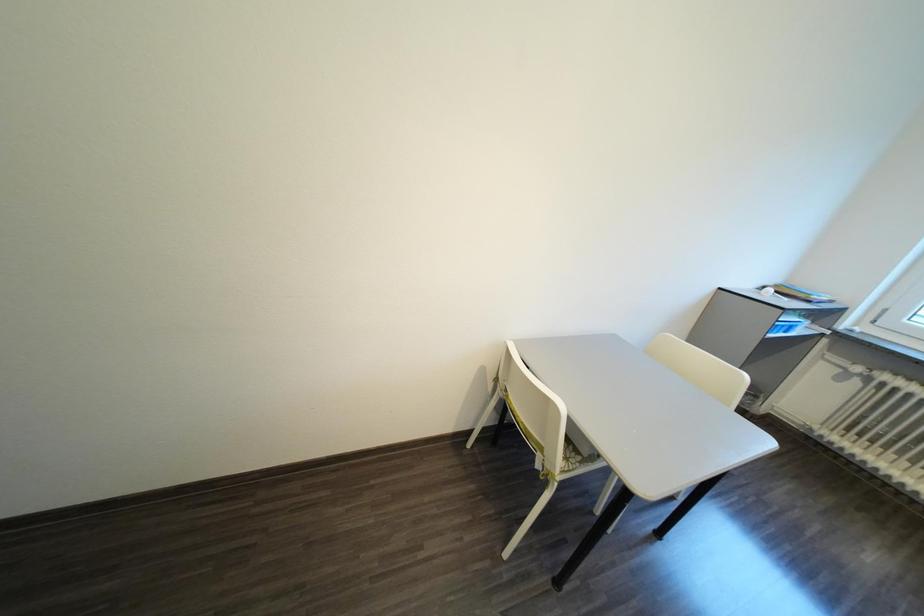
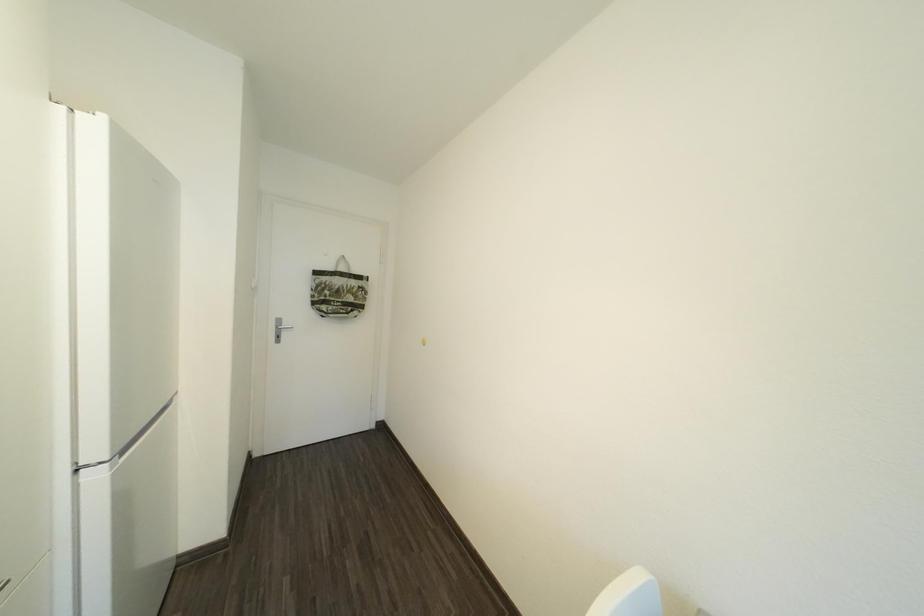
Question: Based on the continuous images, in which direction is the camera rotating? Reply with the corresponding letter.

Choices:
 (A) Left
 (B) Right
 (C) Up
 (D) Down

Answer: (A)